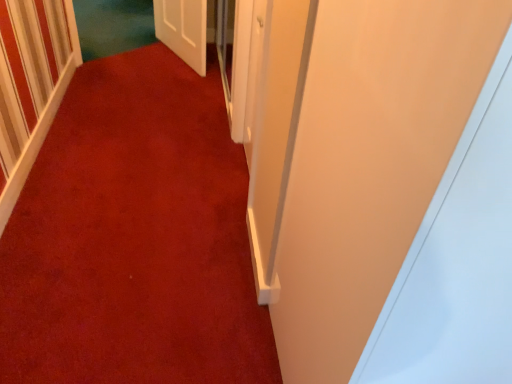
The width and height of the screenshot is (512, 384). What do you see at coordinates (134, 238) in the screenshot?
I see `velvety red carpet at center` at bounding box center [134, 238].

Identify the location of velvety red carpet at center. Image resolution: width=512 pixels, height=384 pixels. (134, 238).

Identify the location of velvety red carpet at center. (134, 238).